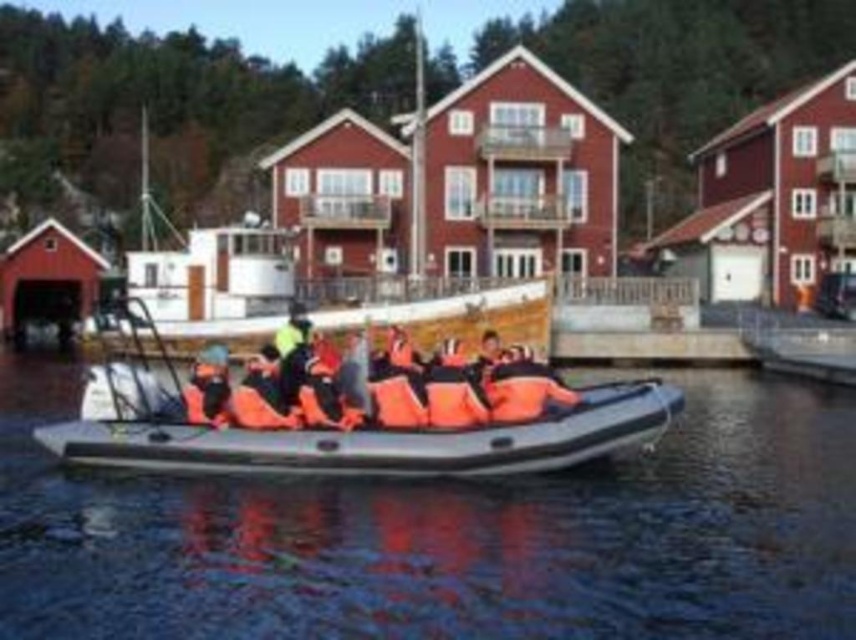
You are a safety inspector on a boat. You need to check the distance between the black rubber boat at center and the orange life vest at center. According to safety regulations, the maximum allowable distance between a boat and a life vest is 10 meters. Is the current distance compliant with safety regulations?

The distance between the black rubber boat at center and the orange life vest at center is 11.43 meters, which exceeds the maximum allowable distance of 10 meters. Therefore, the current distance is not compliant with safety regulations.

You are a safety inspector on a boat tour. You notice the rubber boat at center and the orange life vest at center. According to safety regulations, the minimum required distance between the boat and any life vest should be at least 5 feet to prevent entanglement. Is the current distance compliant?

The rubber boat at center is 4.50 feet from the orange life vest at center. Since the minimum required distance is 5 feet, the current distance of 4.50 feet is not compliant with safety regulations.